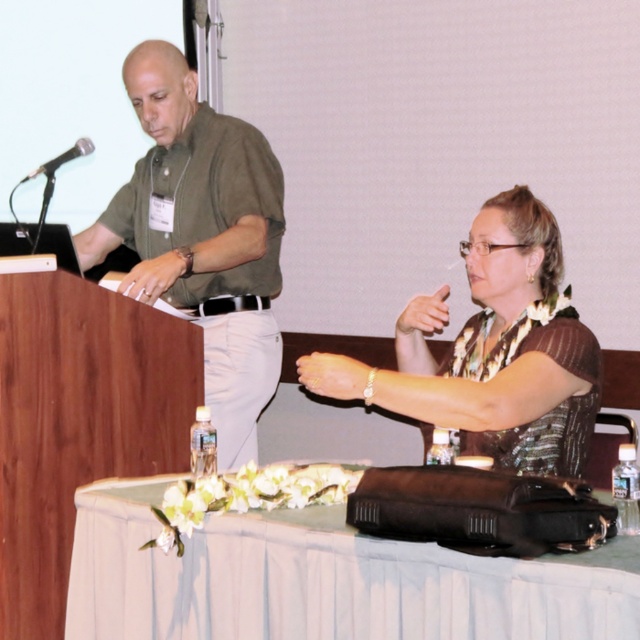
Question: Which object appears closest to the camera in this image?

Choices:
 (A) brown textured blouse at center
 (B) green matte shirt at left

Answer: (A)

Question: From the image, what is the correct spatial relationship of white clothed table at lower center in relation to green matte shirt at left?

Choices:
 (A) left
 (B) right

Answer: (B)

Question: Is white clothed table at lower center to the left of black metallic microphone at left from the viewer's perspective?

Choices:
 (A) no
 (B) yes

Answer: (A)

Question: Where is green matte shirt at left located in relation to black metallic microphone at left in the image?

Choices:
 (A) above
 (B) below

Answer: (B)

Question: Considering the real-world distances, which object is farthest from the black metallic microphone at left?

Choices:
 (A) green matte shirt at left
 (B) brown textured blouse at center

Answer: (B)

Question: Which point is closer to the camera?

Choices:
 (A) (83, 152)
 (B) (248, 522)

Answer: (B)